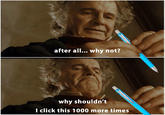
Identify the location of tan back wall. (20, 24), (19, 65).